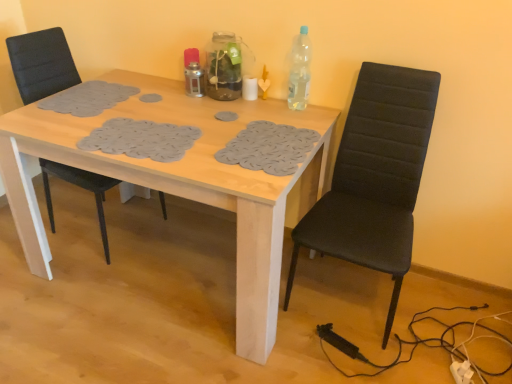
Question: From a real-world perspective, is black fabric chair at left, the 1th chair positioned from the left, positioned under black fabric chair at right, the first chair from the right, based on gravity?

Choices:
 (A) no
 (B) yes

Answer: (A)

Question: Considering the relative positions of black fabric chair at left, placed as the 2th chair when sorted from right to left, and black fabric chair at right, the 2th chair viewed from the left, in the image provided, is black fabric chair at left, placed as the 2th chair when sorted from right to left, to the left of black fabric chair at right, the 2th chair viewed from the left, from the viewer's perspective?

Choices:
 (A) yes
 (B) no

Answer: (A)

Question: From the image's perspective, does black fabric chair at left, the 1th chair positioned from the left, appear higher than black fabric chair at right, the 2th chair viewed from the left?

Choices:
 (A) yes
 (B) no

Answer: (A)

Question: Considering the relative sizes of black fabric chair at left, placed as the 2th chair when sorted from right to left, and black fabric chair at right, the 2th chair viewed from the left, in the image provided, is black fabric chair at left, placed as the 2th chair when sorted from right to left, wider than black fabric chair at right, the 2th chair viewed from the left,?

Choices:
 (A) no
 (B) yes

Answer: (A)

Question: Is black fabric chair at left, the 1th chair positioned from the left, positioned behind black fabric chair at right, the first chair from the right?

Choices:
 (A) no
 (B) yes

Answer: (B)

Question: Are black fabric chair at left, placed as the 2th chair when sorted from right to left, and black fabric chair at right, the 2th chair viewed from the left, beside each other?

Choices:
 (A) no
 (B) yes

Answer: (A)

Question: Is light wood table at center shorter than clear plastic bottle at upper right?

Choices:
 (A) no
 (B) yes

Answer: (A)

Question: Considering the relative positions of light wood table at center and clear plastic bottle at upper right in the image provided, is light wood table at center to the left of clear plastic bottle at upper right from the viewer's perspective?

Choices:
 (A) no
 (B) yes

Answer: (B)

Question: Is clear plastic bottle at upper right inside light wood table at center?

Choices:
 (A) yes
 (B) no

Answer: (B)

Question: Is light wood table at center positioned behind clear plastic bottle at upper right?

Choices:
 (A) no
 (B) yes

Answer: (A)

Question: Does light wood table at center have a lesser width compared to clear plastic bottle at upper right?

Choices:
 (A) no
 (B) yes

Answer: (A)

Question: From the image's perspective, would you say light wood table at center is positioned over clear plastic bottle at upper right?

Choices:
 (A) yes
 (B) no

Answer: (B)

Question: Is clear plastic bottle at upper right aimed at black fabric chair at right, the 2th chair viewed from the left?

Choices:
 (A) no
 (B) yes

Answer: (A)